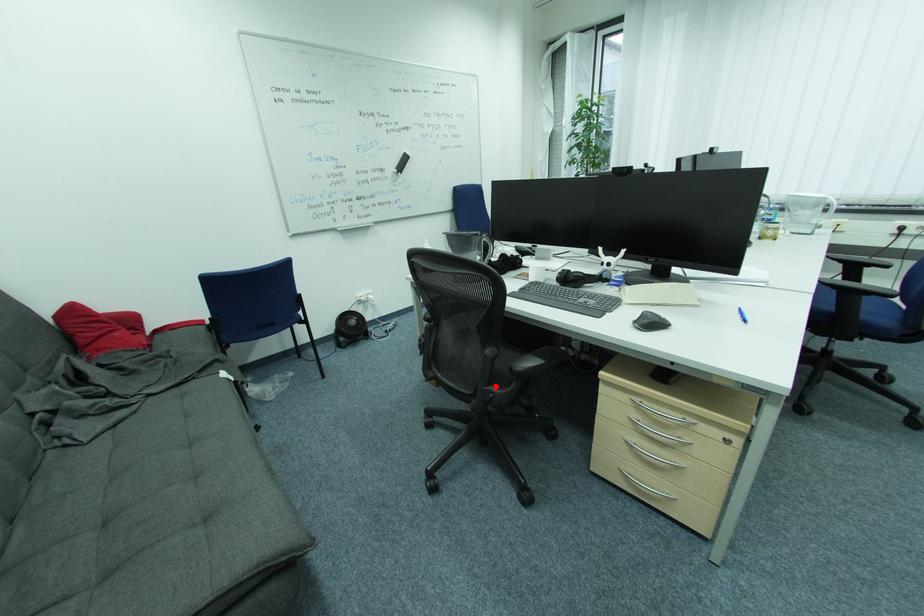
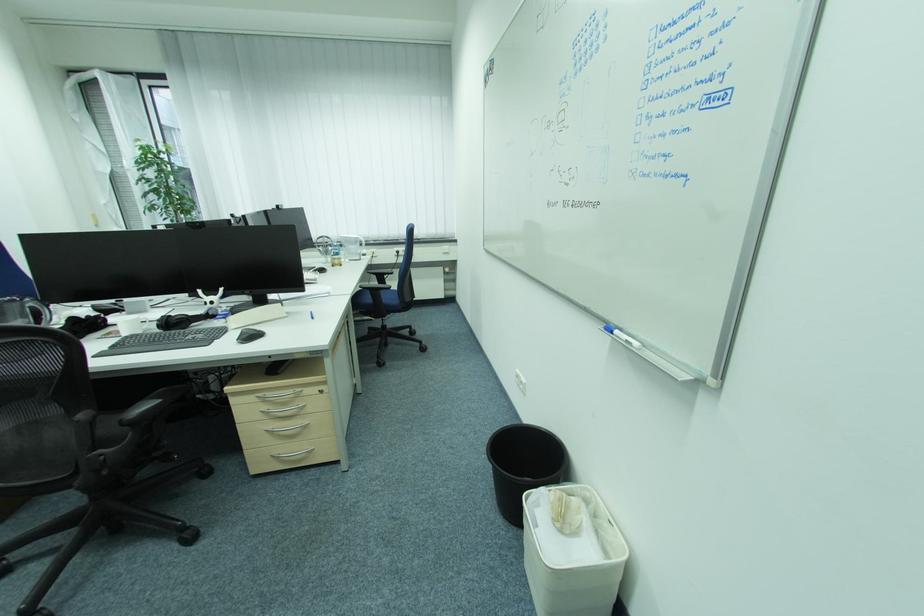
Where in the second image is the point corresponding to the highlighted location from the first image?

(102, 452)